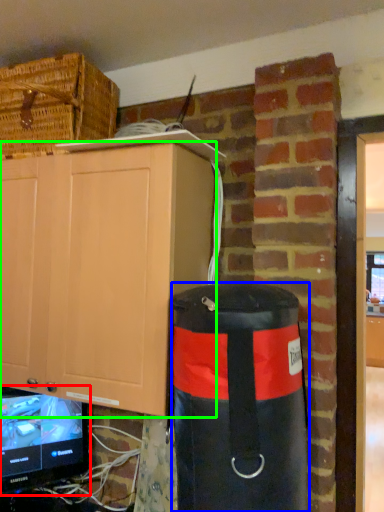
Question: Which object is positioned closest to television (highlighted by a red box)? Select from punching bag (highlighted by a blue box) and cabinetry (highlighted by a green box).

Choices:
 (A) punching bag
 (B) cabinetry

Answer: (B)